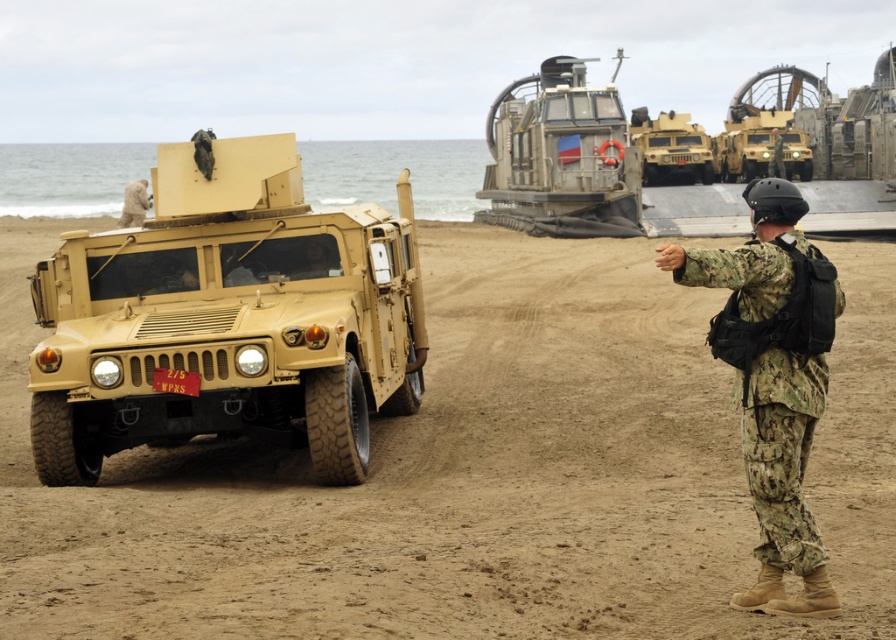
You are a photographer trying to capture a shot of the white fur dog at left and the camouflage uniform at center. Based on their positions, which object is closer to the left edge of the photo?

The white fur dog at left is closer to the left edge of the photo because it is positioned to the left of the camouflage uniform at center.

You are a military planner trying to arrange equipment on a transport truck. The truck has a width limit of 2 meters. You have the tan matte vehicle at left and the camouflage uniform at center. Which item requires more consideration for fitting within the truck width limit?

The tan matte vehicle at left might be wider than the camouflage uniform at center, so it requires more consideration for fitting within the truck width limit of 2 meters.

You are a soldier in the field and need to quickly move from your position at the camouflage fabric uniform at center to the matte tan vehicle at left. Given that you can move at a speed of 1.5 meters per second, how many seconds will it take you to reach the vehicle?

The matte tan vehicle at left is 4.81 meters away from the camouflage fabric uniform at center. At a speed of 1.5 meters per second, dividing the distance by speed gives 4.81 divided by 1.5, which equals approximately 3.21 seconds. Therefore, it will take about 3.21 seconds to reach the vehicle.